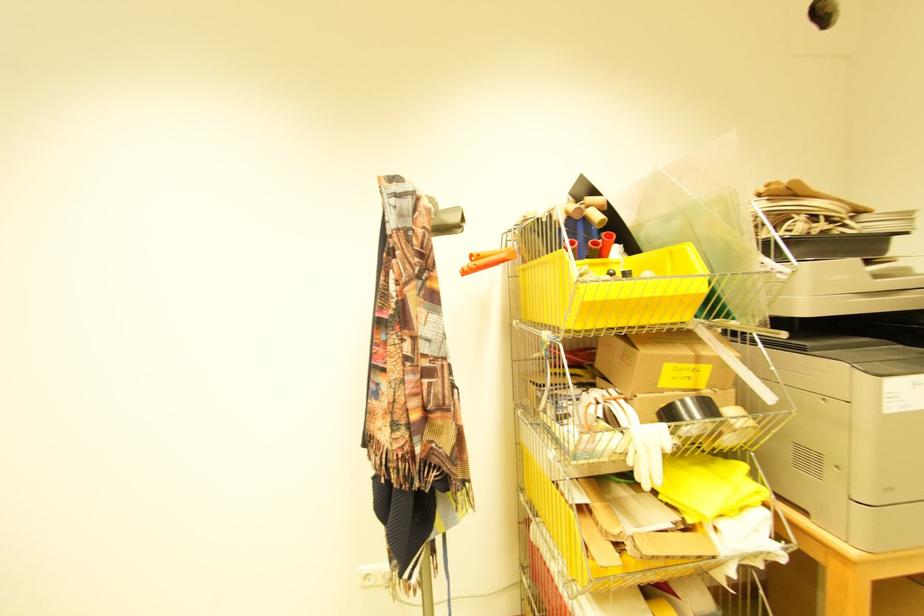
Describe the element at coordinates (689, 415) in the screenshot. I see `the white tape roll` at that location.